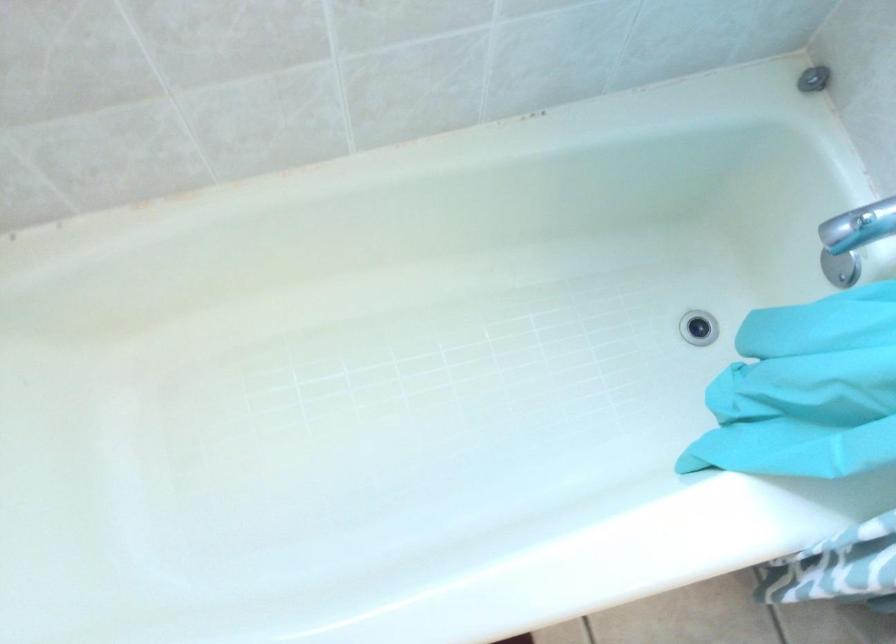
The height and width of the screenshot is (644, 896). Identify the location of shower diverter knob. [x=814, y=79].